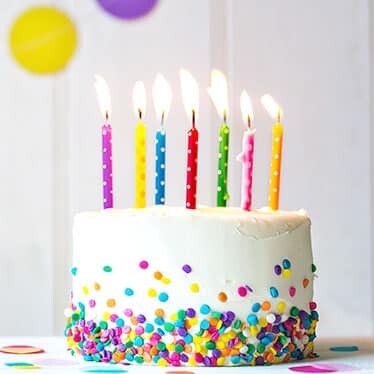
Where is `candle`? The height and width of the screenshot is (374, 374). candle is located at coordinates (109, 166), (145, 154), (161, 171), (194, 175), (223, 171), (248, 172), (283, 162).